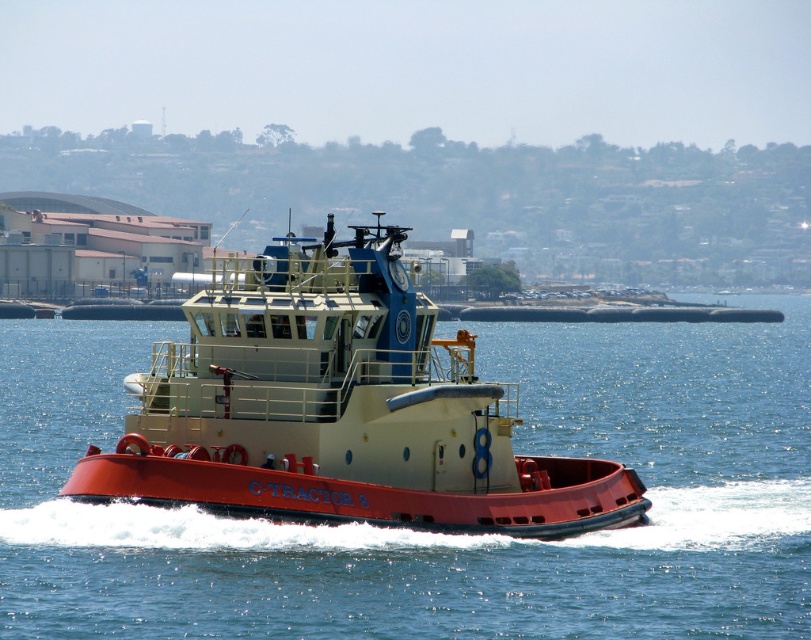
Can you confirm if red matte water at center is positioned below red matte tugboat at center?

Incorrect, red matte water at center is not positioned below red matte tugboat at center.

Is point (443, 326) behind point (355, 326)?

Yes, point (443, 326) is farther from viewer.

Locate an element on the screen. The height and width of the screenshot is (640, 811). red matte water at center is located at coordinates (436, 532).